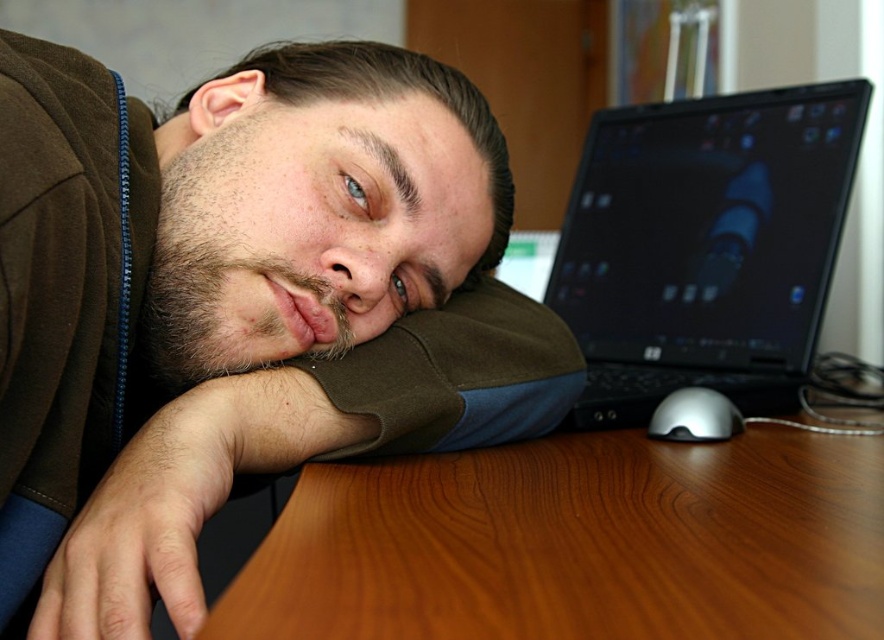
Consider the image. Is brown matte head at center shorter than black glossy laptop at upper right?

Yes.

Is brown matte head at center further to camera compared to black glossy laptop at upper right?

That is False.

Between point (293, 352) and point (608, 236), which one is positioned in front?

Point (293, 352) is in front.

Find the location of a particular element. Image resolution: width=884 pixels, height=640 pixels. brown matte head at center is located at coordinates (317, 204).

Which is below, brown suede jacket at center or black glossy laptop at upper right?

brown suede jacket at center is below.

Is point (318, 77) farther from viewer compared to point (703, 156)?

No, it is in front of (703, 156).

Is point (75, 472) positioned in front of point (648, 408)?

Yes, it is in front of point (648, 408).

Where is `brown suede jacket at center`? brown suede jacket at center is located at coordinates (238, 305).

How much distance is there between brown suede jacket at center and silver metallic mouse at lower right?

37.36 centimeters

Does brown suede jacket at center have a lesser height compared to silver metallic mouse at lower right?

No.

Does point (309, 410) come farther from viewer compared to point (646, 432)?

No, it is not.

The height and width of the screenshot is (640, 884). I want to click on brown suede jacket at center, so click(238, 305).